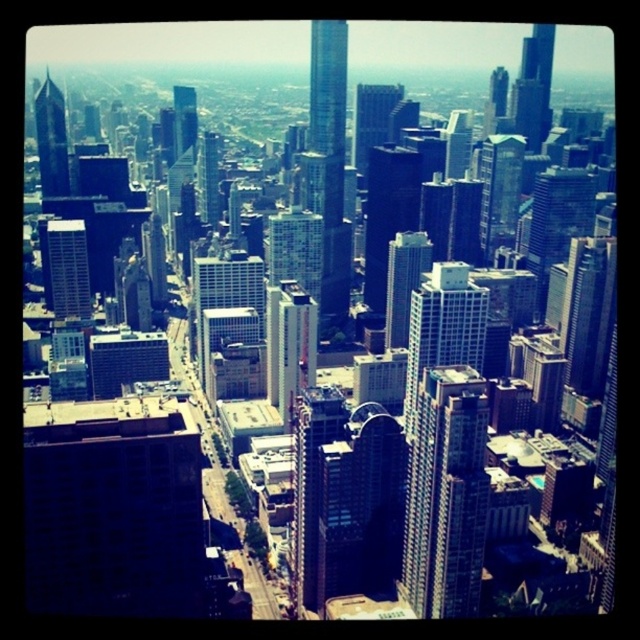
Does sleek glass skyscraper at center have a smaller size compared to shiny glass skyscraper at upper left?

Yes.

Is point (403, 260) behind point (58, 109)?

No, it is not.

Where is `sleek glass skyscraper at center`? The image size is (640, 640). sleek glass skyscraper at center is located at coordinates coord(403,282).

Can you confirm if shiny glass skyscraper at center is bigger than shiny glass skyscraper at upper left?

Indeed, shiny glass skyscraper at center has a larger size compared to shiny glass skyscraper at upper left.

Image resolution: width=640 pixels, height=640 pixels. Identify the location of shiny glass skyscraper at center. (326, 86).

Between point (330, 99) and point (49, 96), which one is positioned behind?

Positioned behind is point (49, 96).

Locate an element on the screen. The height and width of the screenshot is (640, 640). shiny glass skyscraper at center is located at coordinates (326, 86).

Does glassy blue skyscraper at center appear on the right side of glassy reflective skyscraper at center?

Indeed, glassy blue skyscraper at center is positioned on the right side of glassy reflective skyscraper at center.

Is point (420, 420) positioned in front of point (173, 90)?

Yes, point (420, 420) is closer to viewer.

Locate an element on the screen. glassy blue skyscraper at center is located at coordinates (445, 493).